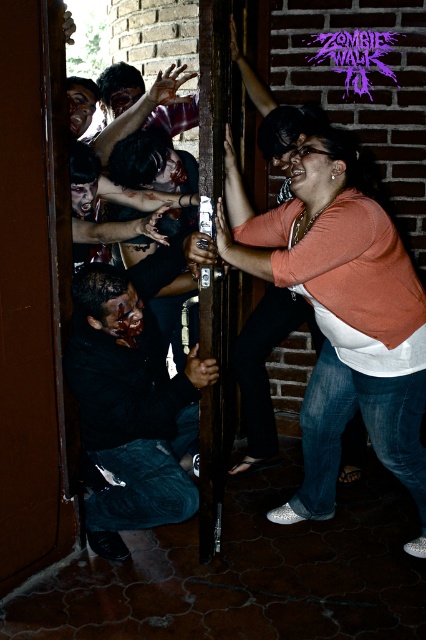
You are the woman pushing the door frame and holding a pole. You need to quickly grab a flashlight from either the orange matte shirt at upper right or the dark matte shirt at center. Which one is easier to reach based on their positions?

The orange matte shirt at upper right is positioned on the right side of dark matte shirt at center, so it is closer to you and easier to reach.

You are a photographer at the zombie walk event. You need to capture a photo where the orange matte shirt at upper right and dark matte shirt at center are both visible. Which shirt will appear taller in the photo?

The orange matte shirt at upper right will appear taller in the photo since it has a greater height compared to the dark matte shirt at center.

You are a photographer at the zombie walk event. You need to capture a photo where the orange matte shirt at upper right and the dark matte shirt at center are both visible. Which of the two shirts should you focus on to ensure it takes up more space in the photo?

The orange matte shirt at upper right should be focused on because it is bigger than the dark matte shirt at center, so it will naturally take up more space in the photo.